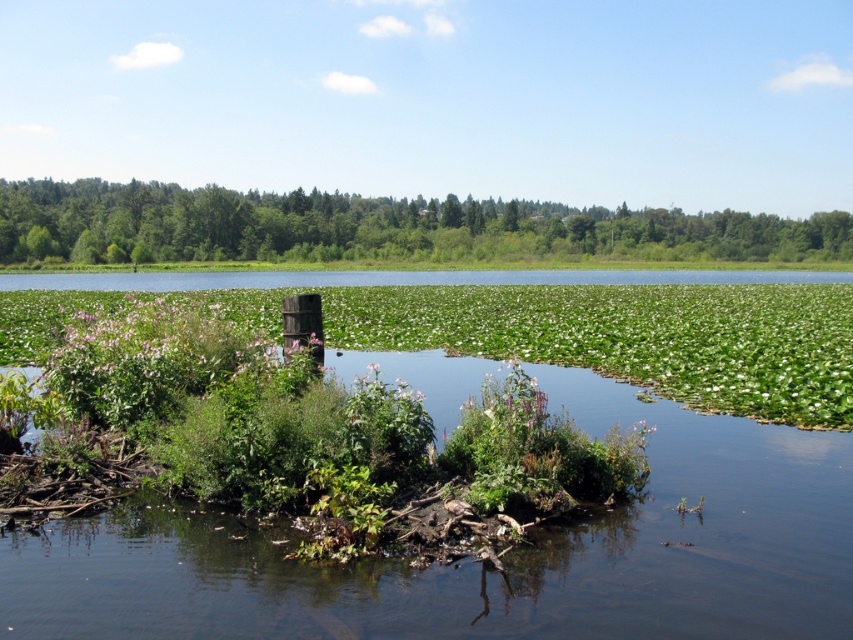
Question: Which point is closer to the camera?

Choices:
 (A) green leafy plant at center
 (B) green leafy tree at upper center

Answer: (A)

Question: Is green leafy plant at center to the left of green leafy tree at upper center from the viewer's perspective?

Choices:
 (A) yes
 (B) no

Answer: (A)

Question: Among these points, which one is nearest to the camera?

Choices:
 (A) (224, 310)
 (B) (57, 252)

Answer: (A)

Question: Is green leafy plant at center in front of green leafy tree at upper center?

Choices:
 (A) yes
 (B) no

Answer: (A)

Question: Is green leafy plant at center wider than green leafy tree at upper center?

Choices:
 (A) no
 (B) yes

Answer: (A)